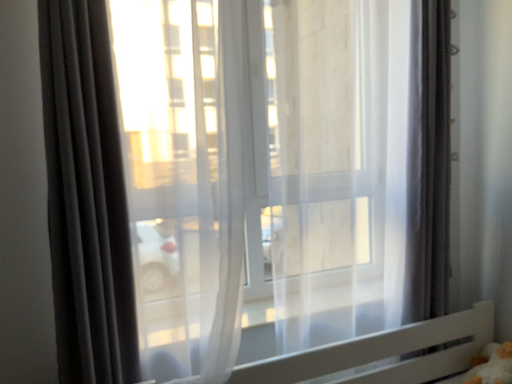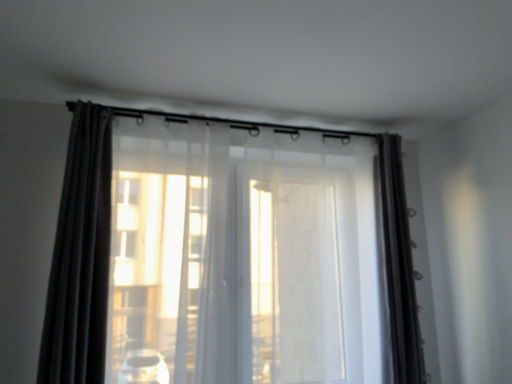
Question: Which way did the camera rotate in the video?

Choices:
 (A) rotated downward
 (B) rotated upward

Answer: (B)